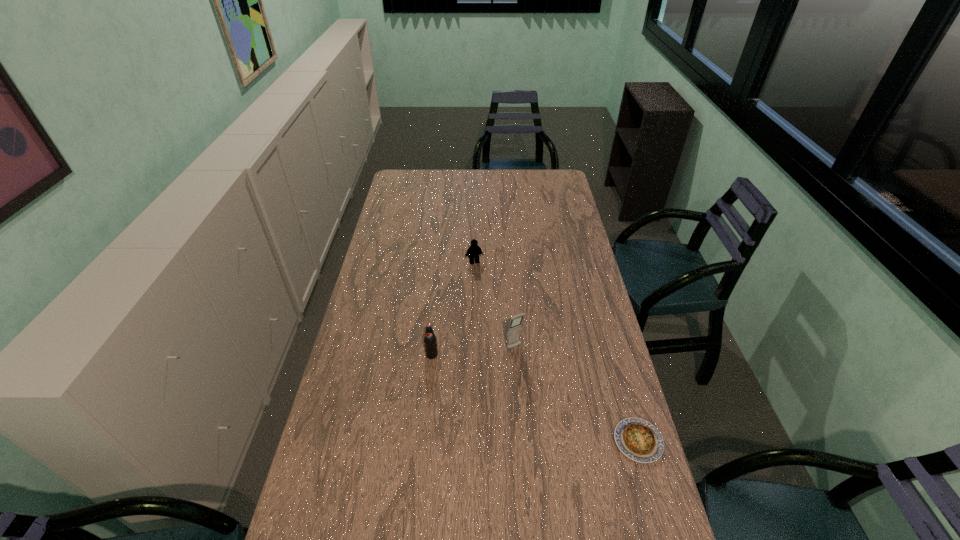
The width and height of the screenshot is (960, 540). Find the location of `blank space located on the front-facing side of the third object from left to right`. blank space located on the front-facing side of the third object from left to right is located at coordinates (530, 369).

The width and height of the screenshot is (960, 540). I want to click on blank area located 0.110m on the front-facing side of the third object from left to right, so click(x=535, y=376).

This screenshot has height=540, width=960. Find the location of `free point located on the face of the farthest object`. free point located on the face of the farthest object is located at coordinates (499, 333).

The width and height of the screenshot is (960, 540). I want to click on vacant space located on the face of the farthest object, so click(485, 289).

Find the location of a particular element. This screenshot has height=540, width=960. free spot located on the face of the farthest object is located at coordinates (497, 327).

Where is `object at the right edge`? The height and width of the screenshot is (540, 960). object at the right edge is located at coordinates (639, 440).

The width and height of the screenshot is (960, 540). I want to click on blank space at the far edge of the desktop, so click(444, 184).

Image resolution: width=960 pixels, height=540 pixels. In the image, there is a desktop. In order to click on blank space at the near edge in this screenshot , I will do `click(537, 522)`.

In the image, there is a desktop. At what (x,y) coordinates should I click in order to perform the action: click on free space at the left edge. Please return your answer as a coordinate pair (x, y). Looking at the image, I should click on (376, 277).

Locate an element on the screen. vacant region at the right edge of the desktop is located at coordinates (562, 326).